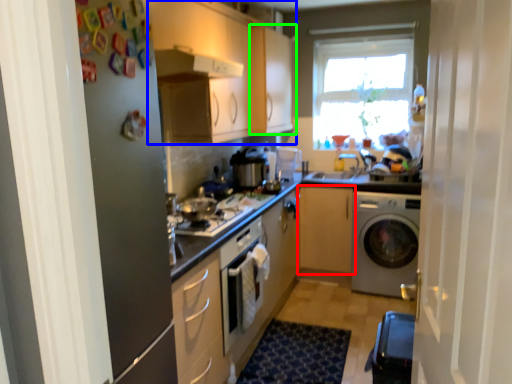
Question: Which object is the closest to the cabinetry (highlighted by a red box)? Choose among these: cabinetry (highlighted by a blue box) or cabinetry (highlighted by a green box).

Choices:
 (A) cabinetry
 (B) cabinetry

Answer: (B)